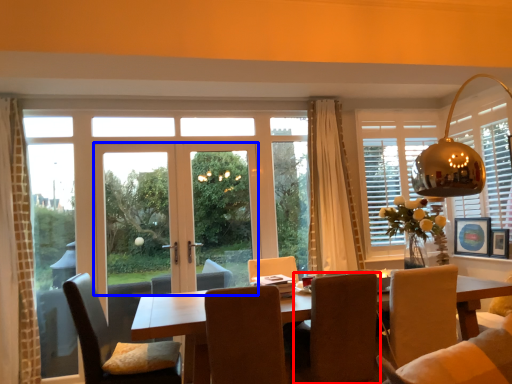
Question: Which of the following is the farthest to the observer, chair (highlighted by a red box) or door (highlighted by a blue box)?

Choices:
 (A) chair
 (B) door

Answer: (B)